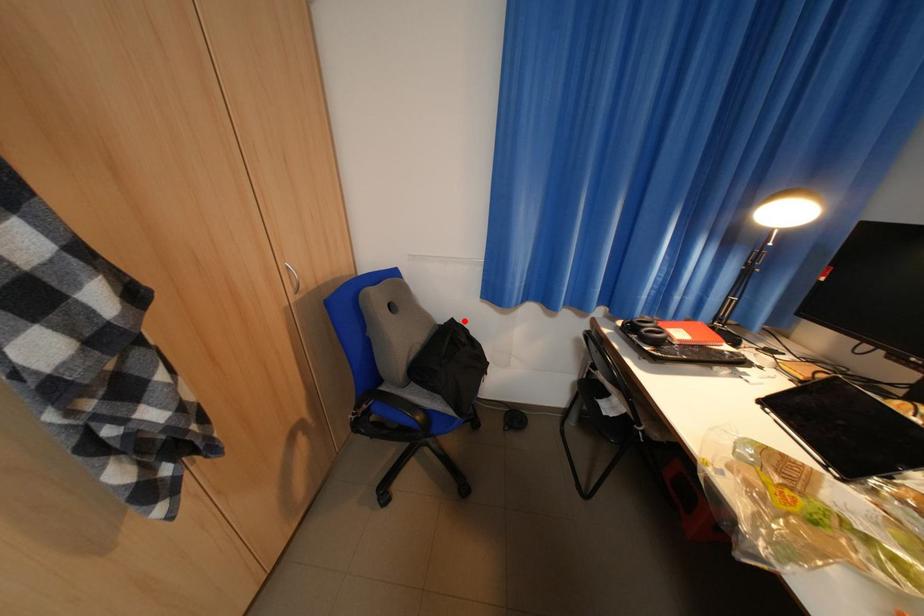
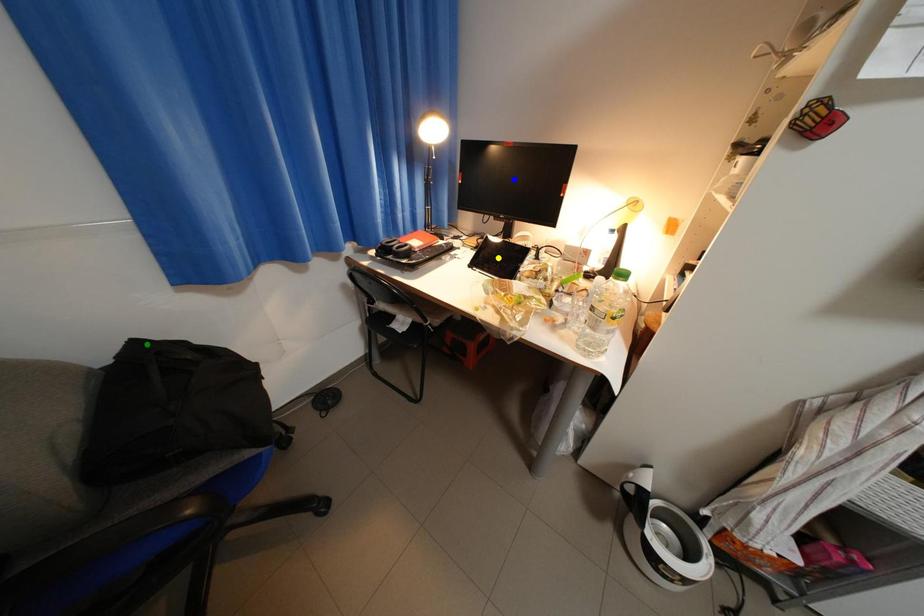
Question: I am providing you with two images of the same scene from different viewpoints. A red point is marked on the first image. You are given multiple points on the second image. Can you choose the point in image 2 that corresponds to the point in image 1?

Choices:
 (A) green point
 (B) blue point
 (C) yellow point

Answer: (A)